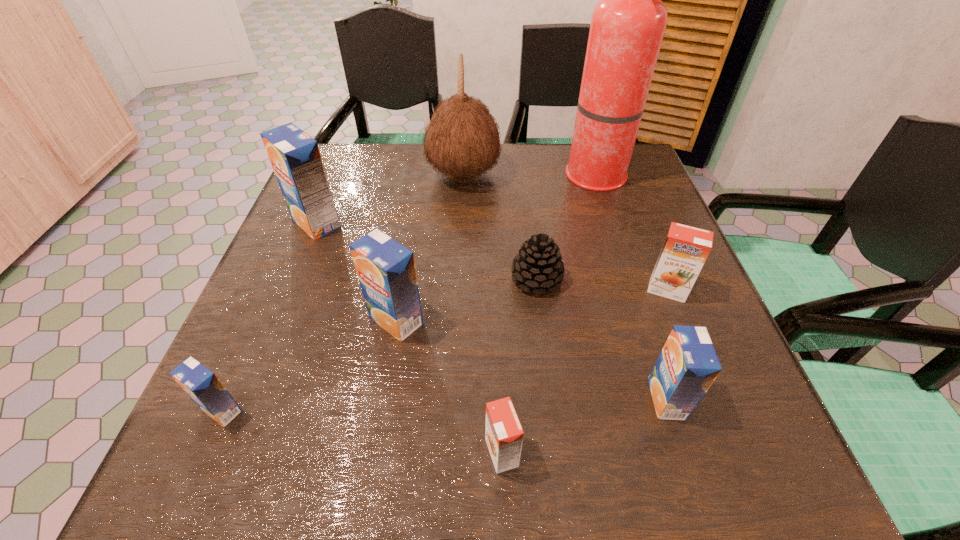
Locate an element on the screen. Image resolution: width=960 pixels, height=540 pixels. free point between the fire extinguisher and the pinecone is located at coordinates (567, 229).

Find the location of a particular element. vacant space in between the pinecone and the bigger orange orange juice is located at coordinates (602, 285).

You are a GUI agent. You are given a task and a screenshot of the screen. Output one action in this format:
    pyautogui.click(x=<x>, y=<y>)
    Task: Click on the free spot between the fire extinguisher and the eighth shortest object
    The width and height of the screenshot is (960, 540).
    Given the screenshot: What is the action you would take?
    (531, 177)

You are a GUI agent. You are given a task and a screenshot of the screen. Output one action in this format:
    pyautogui.click(x=<x>, y=<y>)
    Task: Click on the free space between the pinecone and the fourth orange juice from right to left
    
    Given the screenshot: What is the action you would take?
    pyautogui.click(x=467, y=300)

You are a GUI agent. You are given a task and a screenshot of the screen. Output one action in this format:
    pyautogui.click(x=<x>, y=<y>)
    Task: Click on the blank region between the second farthest blue orange_juice and the smallest blue orange_juice
    The width and height of the screenshot is (960, 540).
    Given the screenshot: What is the action you would take?
    pyautogui.click(x=309, y=365)

Select which object is the eighth closest to the third smallest blue orange_juice. Please provide its 2D coordinates. Your answer should be formatted as a tuple, i.e. [(x, y)], where the tuple contains the x and y coordinates of a point satisfying the conditions above.

[(685, 250)]

Select which object appears as the fourth closest to the fire extinguisher. Please provide its 2D coordinates. Your answer should be formatted as a tuple, i.e. [(x, y)], where the tuple contains the x and y coordinates of a point satisfying the conditions above.

[(386, 271)]

At what (x,y) coordinates should I click in order to perform the action: click on orange juice that stands as the third closest to the eighth shortest object. Please return your answer as a coordinate pair (x, y). This screenshot has width=960, height=540. Looking at the image, I should click on [x=685, y=250].

Identify the location of the third closest orange juice to the fourth orange juice from left to right. The image size is (960, 540). (685, 250).

Select which blue orange_juice is the second closest to the sixth object from left to right. Please provide its 2D coordinates. Your answer should be formatted as a tuple, i.e. [(x, y)], where the tuple contains the x and y coordinates of a point satisfying the conditions above.

[(687, 366)]